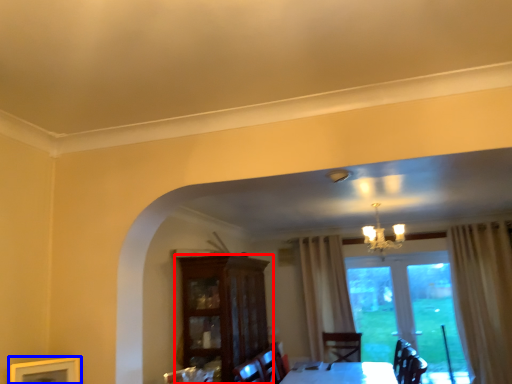
Question: Which object is closer to the camera taking this photo, cabinetry (highlighted by a red box) or picture frame (highlighted by a blue box)?

Choices:
 (A) cabinetry
 (B) picture frame

Answer: (B)